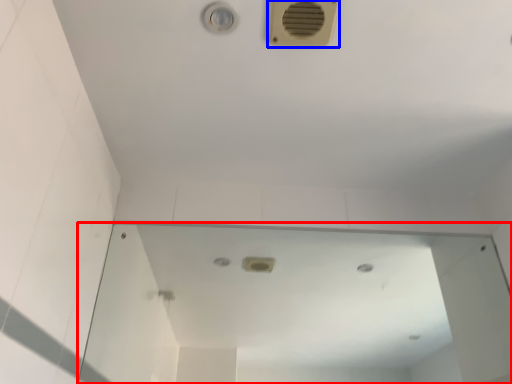
Question: Which of the following is the farthest to the observer, mirror (highlighted by a red box) or air conditioning (highlighted by a blue box)?

Choices:
 (A) mirror
 (B) air conditioning

Answer: (A)